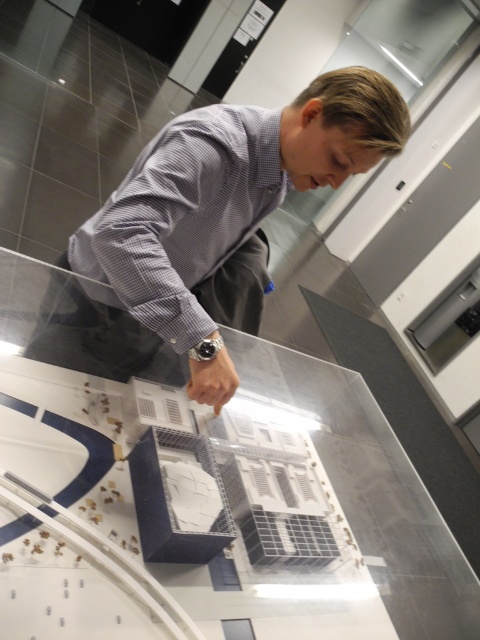
Question: Which point is closer to the camera?

Choices:
 (A) (152, 310)
 (B) (31, 289)
 (C) (166, 236)

Answer: (A)

Question: Can you confirm if gray checkered shirt at upper center is positioned to the left of gray checkered dress shirt at center?

Choices:
 (A) no
 (B) yes

Answer: (A)

Question: Which point appears closest to the camera in this image?

Choices:
 (A) (260, 208)
 (B) (168, 170)
 (C) (455, 545)
 (D) (207, 356)

Answer: (B)

Question: Does transparent glass table at center have a lesser width compared to gray checkered dress shirt at center?

Choices:
 (A) yes
 (B) no

Answer: (B)

Question: Considering the real-world distances, which object is closest to the gray checkered shirt at upper center?

Choices:
 (A) metallic silver watch at center
 (B) transparent glass table at center
 (C) gray checkered dress shirt at center

Answer: (C)

Question: Is transparent glass table at center wider than gray checkered dress shirt at center?

Choices:
 (A) yes
 (B) no

Answer: (A)